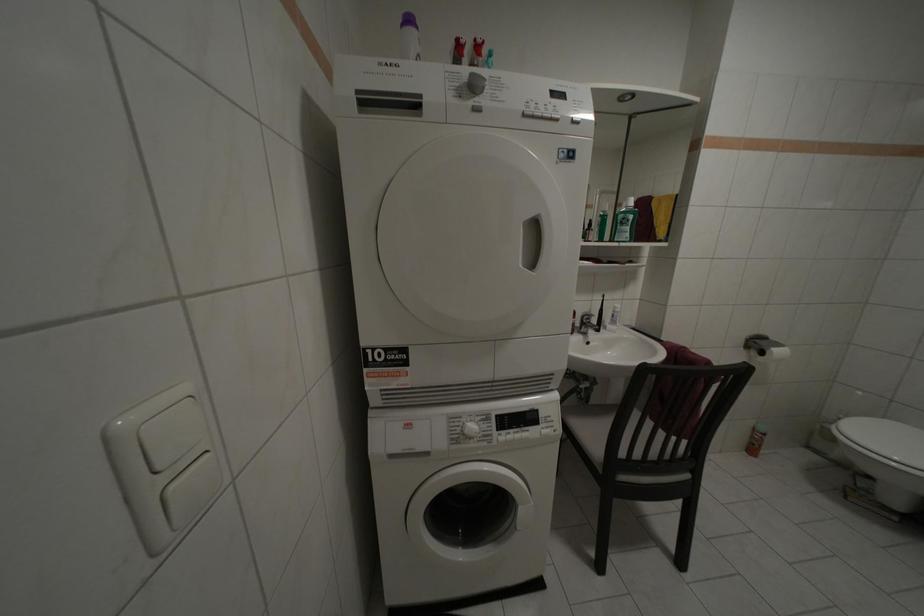
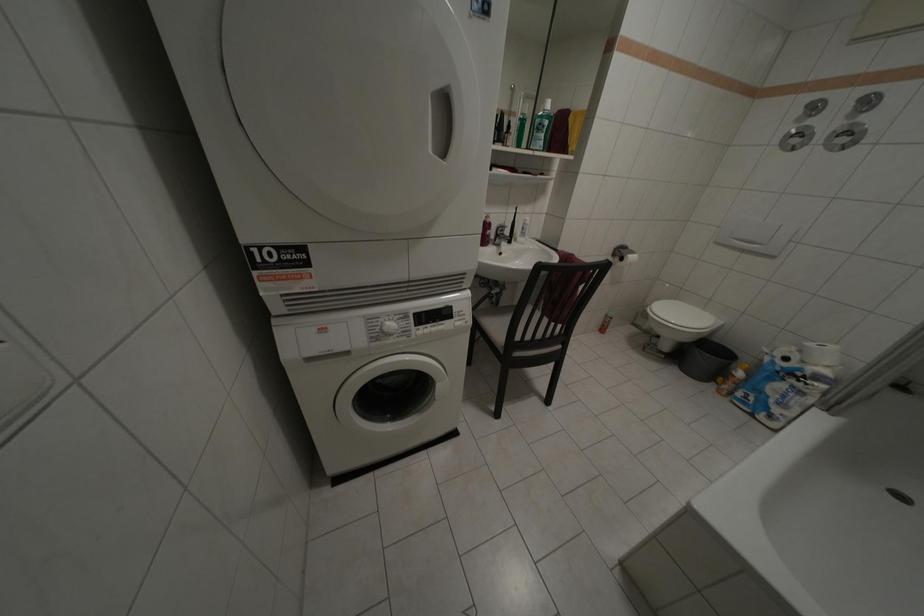
From the picture: First-person continuous shooting, in which direction is the camera rotating?

The rotation direction of the camera is right-down.